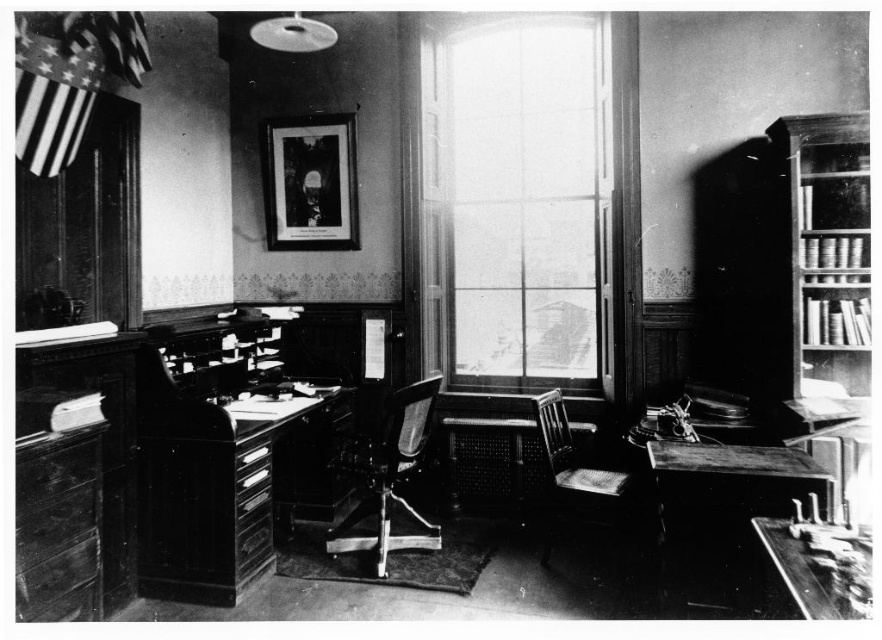
Question: Estimate the real-world distances between objects in this image. Which object is closer to the wooden desk at right?

Choices:
 (A) metallic polished chair at center
 (B) wooden desk at center

Answer: (A)

Question: From the image, what is the correct spatial relationship of wooden bookshelf at right in relation to wooden desk at right?

Choices:
 (A) right
 (B) left

Answer: (A)

Question: Does wooden desk at center have a smaller size compared to metallic polished chair at center?

Choices:
 (A) no
 (B) yes

Answer: (A)

Question: Is the position of wooden desk at center less distant than that of wooden desk at right?

Choices:
 (A) yes
 (B) no

Answer: (B)

Question: Estimate the real-world distances between objects in this image. Which object is closer to the metallic polished chair at center?

Choices:
 (A) wooden bookshelf at right
 (B) wooden desk at right
 (C) transparent glass window at center
 (D) wooden desk at center

Answer: (D)

Question: Which of these objects is positioned farthest from the metallic polished chair at center?

Choices:
 (A) transparent glass window at center
 (B) wooden desk at lower right
 (C) wooden chair at center

Answer: (B)